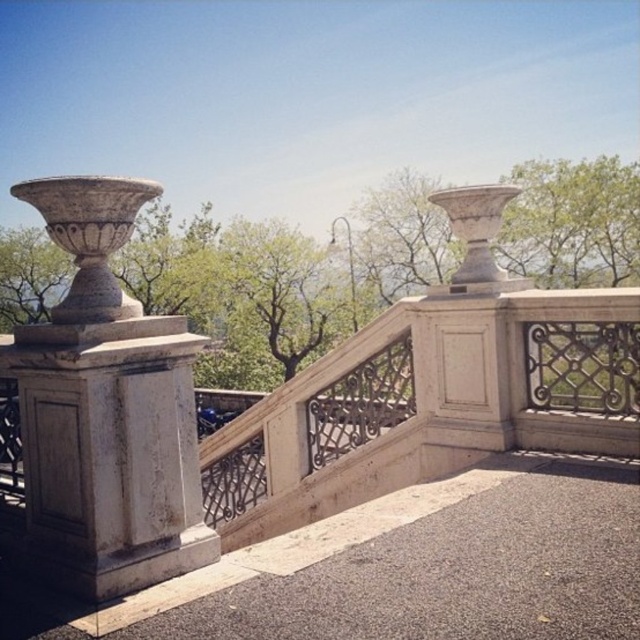
You are standing in front of the stone balustrade and want to place a small potted plant between the white marble vase at left and the green leafy tree at upper left. Which object should you place it closer to if you want the plant to be closer to the viewer?

The white marble vase at left is closer to the viewer than the green leafy tree at upper left, so placing the potted plant closer to the white marble vase at left will make it closer to the viewer.

You are standing at the viewpoint and see two points marked in the image. Which point is closer to you, point (182, 404) or point (49, 291)?

Point (182, 404) is closer to you because it is in front of point (49, 291).